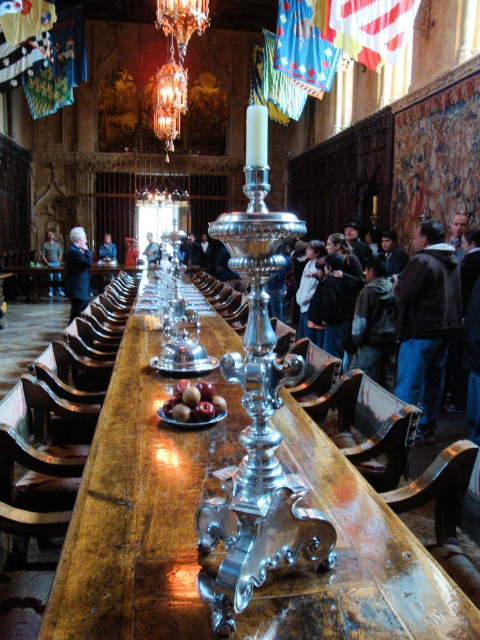
You are a guest at this medieval banquet and notice both the polished wood table at center and the dark brown leather jacket at center. Which object is taller when observed from above?

The dark brown leather jacket at center is taller than the polished wood table at center.